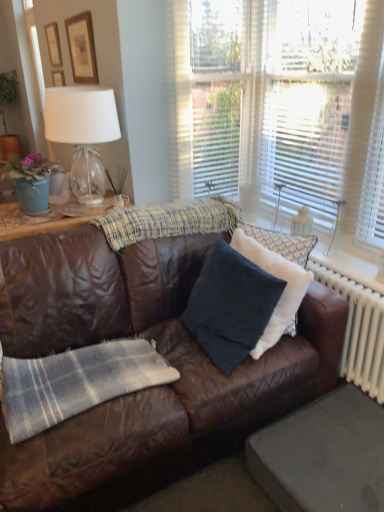
Locate an element on the screen. gray fabric footrest at lower right is located at coordinates (323, 455).

I want to click on brown leather couch at center, so click(147, 389).

Consider the image. In order to face dark blue fabric pillow at center, which is the 2th pillow from right to left, should I rotate leftwards or rightwards?

You should look right and rotate roughly 4.550 degrees.

Where is `white textured curtain at upper right`? This screenshot has height=512, width=384. white textured curtain at upper right is located at coordinates (283, 105).

What do you see at coordinates (283, 105) in the screenshot? I see `white textured curtain at upper right` at bounding box center [283, 105].

This screenshot has height=512, width=384. What do you see at coordinates (305, 145) in the screenshot? I see `white blinds at upper center` at bounding box center [305, 145].

What do you see at coordinates (282, 292) in the screenshot? I see `dark blue suede pillow at center, which is counted as the 1th pillow, starting from the right` at bounding box center [282, 292].

The image size is (384, 512). I want to click on white plastic radiator at right, so click(x=359, y=331).

From the image's perspective, is wooden picture frame at upper left, which appears as the 1th picture frame when viewed from the right, located beneath brown leather couch at center?

Actually, wooden picture frame at upper left, which appears as the 1th picture frame when viewed from the right, appears above brown leather couch at center in the image.

From a real-world perspective, which is physically below, wooden picture frame at upper left, positioned as the second picture frame in back-to-front order, or brown leather couch at center?

From a 3D spatial view, brown leather couch at center is below.

From the image's perspective, which picture frame is the 1st one above the brown leather couch at center? Please provide its 2D coordinates.

[(82, 48)]

Based on the photo, how distant is wooden picture frame at upper left, the 2th picture frame in the left-to-right sequence, from brown leather couch at center?

They are 1.56 meters apart.

In the image, is dark blue suede pillow at center, which appears as the second pillow when viewed from the left, positioned in front of or behind gray fabric footrest at lower right?

dark blue suede pillow at center, which appears as the second pillow when viewed from the left, is behind gray fabric footrest at lower right.

Can you confirm if dark blue suede pillow at center, which appears as the second pillow when viewed from the left, is bigger than gray fabric footrest at lower right?

Yes.

Between dark blue suede pillow at center, which is counted as the 1th pillow, starting from the right, and gray fabric footrest at lower right, which one appears on the right side from the viewer's perspective?

From the viewer's perspective, gray fabric footrest at lower right appears more on the right side.

At what (x,y) coordinates should I click in order to perform the action: click on pillow that is the 2nd one above the gray fabric footrest at lower right (from a real-world perspective). Please return your answer as a coordinate pair (x, y). This screenshot has width=384, height=512. Looking at the image, I should click on (282, 292).

Is white blinds at upper center further to camera compared to dark blue suede pillow at center, which is counted as the 1th pillow, starting from the right?

Yes, it is behind dark blue suede pillow at center, which is counted as the 1th pillow, starting from the right.

Is white blinds at upper center positioned with its back to dark blue suede pillow at center, which is counted as the 1th pillow, starting from the right?

No, white blinds at upper center is not facing away from dark blue suede pillow at center, which is counted as the 1th pillow, starting from the right.

From a real-world perspective, is white blinds at upper center on top of dark blue suede pillow at center, which is counted as the 1th pillow, starting from the right?

Yes, from a real-world perspective, white blinds at upper center is on top of dark blue suede pillow at center, which is counted as the 1th pillow, starting from the right.

The image size is (384, 512). I want to click on studio couch below the knitted woolen blanket at center (from the image's perspective), so click(x=147, y=389).

Between knitted woolen blanket at center and brown leather couch at center, which one appears on the right side from the viewer's perspective?

From the viewer's perspective, knitted woolen blanket at center appears more on the right side.

From the image's perspective, which is above, knitted woolen blanket at center or brown leather couch at center?

From the image's view, knitted woolen blanket at center is above.

Looking at their sizes, would you say knitted woolen blanket at center is wider or thinner than brown leather couch at center?

knitted woolen blanket at center is thinner than brown leather couch at center.

Which is in front, wooden picture frame at upper left, the 2th picture frame from the right, or dark blue fabric pillow at center, which is the 1th pillow in left-to-right order?

dark blue fabric pillow at center, which is the 1th pillow in left-to-right order, is more forward.

Is wooden picture frame at upper left, the 1th picture frame viewed from the back, with dark blue fabric pillow at center, which is the 1th pillow in left-to-right order?

There is a gap between wooden picture frame at upper left, the 1th picture frame viewed from the back, and dark blue fabric pillow at center, which is the 1th pillow in left-to-right order.

From the image's perspective, does wooden picture frame at upper left, arranged as the 1th picture frame when viewed from the left, appear lower than dark blue fabric pillow at center, which is the 2th pillow from right to left?

No.

Is wooden picture frame at upper left, the 2th picture frame from the right, shorter than dark blue fabric pillow at center, which is the 2th pillow from right to left?

Yes, wooden picture frame at upper left, the 2th picture frame from the right, is shorter than dark blue fabric pillow at center, which is the 2th pillow from right to left.

Is brown leather couch at center wider than plaid fabric at left?

Indeed, brown leather couch at center has a greater width compared to plaid fabric at left.

Could plaid fabric at left be considered to be inside brown leather couch at center?

Yes, plaid fabric at left is surrounded by brown leather couch at center.

Considering the relative positions of brown leather couch at center and plaid fabric at left in the image provided, is brown leather couch at center behind plaid fabric at left?

No, it is in front of plaid fabric at left.

Is brown leather couch at center far from plaid fabric at left?

No, brown leather couch at center is in close proximity to plaid fabric at left.

In the scene shown: Between white plastic radiator at right and white textured curtain at upper right, which one has less height?

With less height is white plastic radiator at right.

Does white plastic radiator at right have a larger size compared to white textured curtain at upper right?

Incorrect, white plastic radiator at right is not larger than white textured curtain at upper right.

Is point (325, 267) farther from viewer compared to point (213, 178)?

No.

Are white plastic radiator at right and white textured curtain at upper right located far from each other?

No, there isn't a large distance between white plastic radiator at right and white textured curtain at upper right.

Identify the location of studio couch below the wooden picture frame at upper left, which appears as the 1th picture frame when viewed from the right (from the image's perspective). The height and width of the screenshot is (512, 384). (147, 389).

This screenshot has width=384, height=512. In the image, there is a dark blue suede pillow at center, which is counted as the 1th pillow, starting from the right. Find the location of `the footrest below it (from a real-world perspective)`. the footrest below it (from a real-world perspective) is located at coordinates (323, 455).

When comparing their distances from dark blue suede pillow at center, which appears as the second pillow when viewed from the left, does brown leather couch at center or white textured curtain at upper right seem closer?

The object closer to dark blue suede pillow at center, which appears as the second pillow when viewed from the left, is brown leather couch at center.

Based on their spatial positions, is white blinds at upper center or dark blue fabric pillow at center, which is the 1th pillow in left-to-right order, further from clear glass lampshade at upper left?

white blinds at upper center lies further to clear glass lampshade at upper left than the other object.

From the image, which object appears to be farther from clear glass lampshade at upper left, gray fabric footrest at lower right or white blinds at upper center?

gray fabric footrest at lower right lies further to clear glass lampshade at upper left than the other object.

Which object lies further to the anchor point brown leather couch at center, dark blue suede pillow at center, which appears as the second pillow when viewed from the left, or dark blue fabric pillow at center, which is the 1th pillow in left-to-right order?

Among the two, dark blue suede pillow at center, which appears as the second pillow when viewed from the left, is located further to brown leather couch at center.

Estimate the real-world distances between objects in this image. Which object is closer to wooden picture frame at upper left, arranged as the 1th picture frame when viewed from the left, white sheer curtain at right or clear glass lampshade at upper left?

Among the two, clear glass lampshade at upper left is located nearer to wooden picture frame at upper left, arranged as the 1th picture frame when viewed from the left.

Looking at the image, which one is located further to plaid fabric at left, dark blue fabric pillow at center, which is the 2th pillow from right to left, or white sheer curtain at right?

Based on the image, white sheer curtain at right appears to be further to plaid fabric at left.

Estimate the real-world distances between objects in this image. Which object is further from white textured curtain at upper right, gray fabric footrest at lower right or plaid fabric at left?

Among the two, plaid fabric at left is located further to white textured curtain at upper right.

Which object lies nearer to the anchor point brown leather couch at center, dark blue fabric pillow at center, which is the 1th pillow in left-to-right order, or white textured curtain at upper right?

dark blue fabric pillow at center, which is the 1th pillow in left-to-right order, is positioned closer to the anchor brown leather couch at center.

I want to click on the footrest located between brown leather couch at center and white plastic radiator at right in the left-right direction, so click(x=323, y=455).

What are the coordinates of `window between wooden picture frame at upper left, positioned as the second picture frame in back-to-front order, and dark blue fabric pillow at center, which is the 2th pillow from right to left, in the vertical direction` in the screenshot? It's located at (283, 105).

Find the location of `curtain between wooden picture frame at upper left, which appears as the first picture frame when viewed from the front, and gray fabric footrest at lower right, in the vertical direction`. curtain between wooden picture frame at upper left, which appears as the first picture frame when viewed from the front, and gray fabric footrest at lower right, in the vertical direction is located at coordinates (368, 122).

This screenshot has height=512, width=384. Find the location of `table lamp between white blinds at upper center and plaid fabric at left in the up-down direction`. table lamp between white blinds at upper center and plaid fabric at left in the up-down direction is located at coordinates (83, 133).